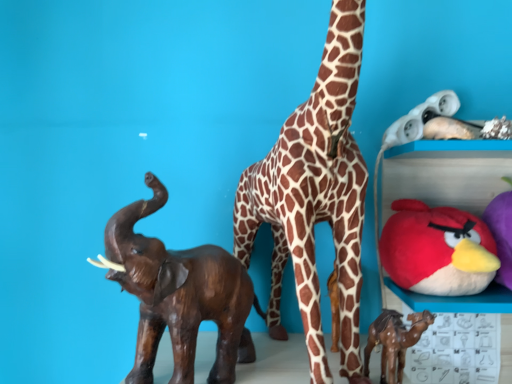
Question: Does brown spotted fabric giraffe at center have a greater width compared to red plush toy at upper right, marked as the 3th toy in a left-to-right arrangement?

Choices:
 (A) no
 (B) yes

Answer: (B)

Question: Considering the relative sizes of brown spotted fabric giraffe at center and red plush toy at upper right, marked as the 3th toy in a left-to-right arrangement, in the image provided, is brown spotted fabric giraffe at center bigger than red plush toy at upper right, marked as the 3th toy in a left-to-right arrangement,?

Choices:
 (A) yes
 (B) no

Answer: (A)

Question: Is brown spotted fabric giraffe at center to the left of red plush toy at upper right, the second toy when ordered from right to left, from the viewer's perspective?

Choices:
 (A) yes
 (B) no

Answer: (A)

Question: Is brown spotted fabric giraffe at center facing away from red plush toy at upper right, the second toy when ordered from right to left?

Choices:
 (A) yes
 (B) no

Answer: (B)

Question: Is brown spotted fabric giraffe at center closer to camera compared to red plush toy at upper right, the second toy when ordered from right to left?

Choices:
 (A) yes
 (B) no

Answer: (A)

Question: Considering the relative positions of brown spotted fabric giraffe at center and brown wooden elephant at left, acting as the fourth toy starting from the right, in the image provided, is brown spotted fabric giraffe at center to the left or to the right of brown wooden elephant at left, acting as the fourth toy starting from the right,?

Choices:
 (A) left
 (B) right

Answer: (B)

Question: Is point (342, 192) positioned closer to the camera than point (137, 357)?

Choices:
 (A) closer
 (B) farther

Answer: (A)

Question: From a real-world perspective, is brown spotted fabric giraffe at center physically located above or below brown wooden elephant at left, placed as the first toy when sorted from left to right?

Choices:
 (A) below
 (B) above

Answer: (B)

Question: Looking at the image, does brown spotted fabric giraffe at center seem bigger or smaller compared to brown wooden elephant at left, placed as the first toy when sorted from left to right?

Choices:
 (A) big
 (B) small

Answer: (A)

Question: From a real-world perspective, is soft plush bird at right, the 1th toy when ordered from right to left, physically located above or below brown wooden elephant at left, acting as the fourth toy starting from the right?

Choices:
 (A) below
 (B) above

Answer: (B)

Question: From the image's perspective, relative to brown wooden elephant at left, placed as the first toy when sorted from left to right, is soft plush bird at right, which appears as the fourth toy when viewed from the left, above or below?

Choices:
 (A) below
 (B) above

Answer: (B)

Question: Considering the positions of soft plush bird at right, which appears as the fourth toy when viewed from the left, and brown wooden elephant at left, acting as the fourth toy starting from the right, in the image, is soft plush bird at right, which appears as the fourth toy when viewed from the left, wider or thinner than brown wooden elephant at left, acting as the fourth toy starting from the right,?

Choices:
 (A) wide
 (B) thin

Answer: (A)

Question: Is soft plush bird at right, the 1th toy when ordered from right to left, to the left or to the right of brown wooden elephant at left, acting as the fourth toy starting from the right, in the image?

Choices:
 (A) left
 (B) right

Answer: (B)

Question: Looking at the image, does brown spotted fabric giraffe at center seem bigger or smaller compared to soft plush bird at right, which appears as the fourth toy when viewed from the left?

Choices:
 (A) small
 (B) big

Answer: (B)

Question: Is brown spotted fabric giraffe at center taller or shorter than soft plush bird at right, the 1th toy when ordered from right to left?

Choices:
 (A) short
 (B) tall

Answer: (B)